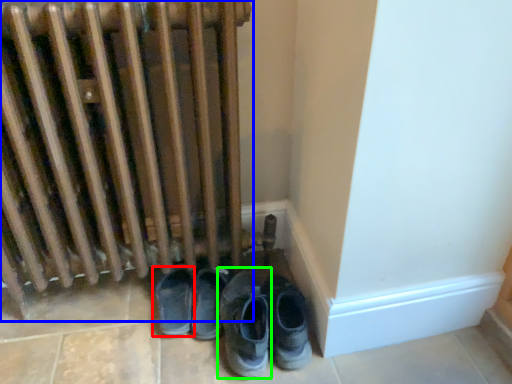
Question: Which object is the farthest from footwear (highlighted by a red box)? Choose among these: radiator (highlighted by a blue box) or footwear (highlighted by a green box).

Choices:
 (A) radiator
 (B) footwear

Answer: (A)